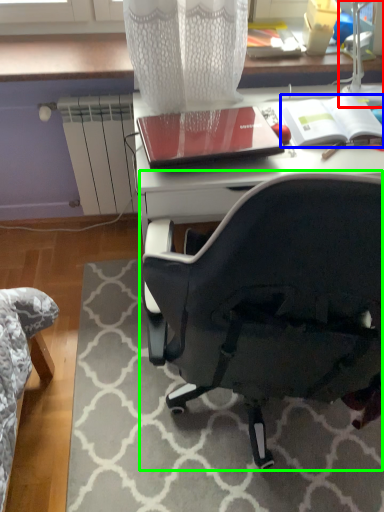
Question: Which is farther away from table lamp (highlighted by a red box)? notebook (highlighted by a blue box) or chair (highlighted by a green box)?

Choices:
 (A) notebook
 (B) chair

Answer: (B)